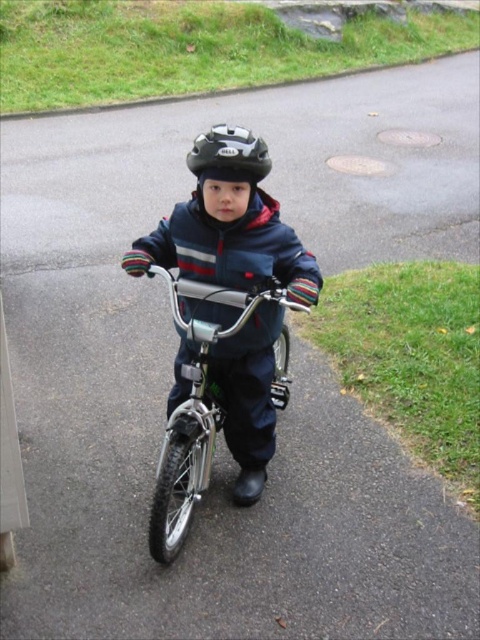
Question: Does shiny metallic bicycle at center have a greater width compared to matte black helmet at center?

Choices:
 (A) no
 (B) yes

Answer: (B)

Question: Among these points, which one is nearest to the camera?

Choices:
 (A) (190, 323)
 (B) (215, 164)

Answer: (B)

Question: Is shiny metallic bicycle at center smaller than matte black helmet at center?

Choices:
 (A) no
 (B) yes

Answer: (A)

Question: Does shiny metallic bicycle at center appear on the left side of matte black helmet at center?

Choices:
 (A) no
 (B) yes

Answer: (B)

Question: Which object is farther from the camera taking this photo?

Choices:
 (A) matte black helmet at center
 (B) shiny metallic bicycle at center

Answer: (A)

Question: Among these points, which one is nearest to the camera?

Choices:
 (A) (184, 428)
 (B) (228, 164)

Answer: (B)